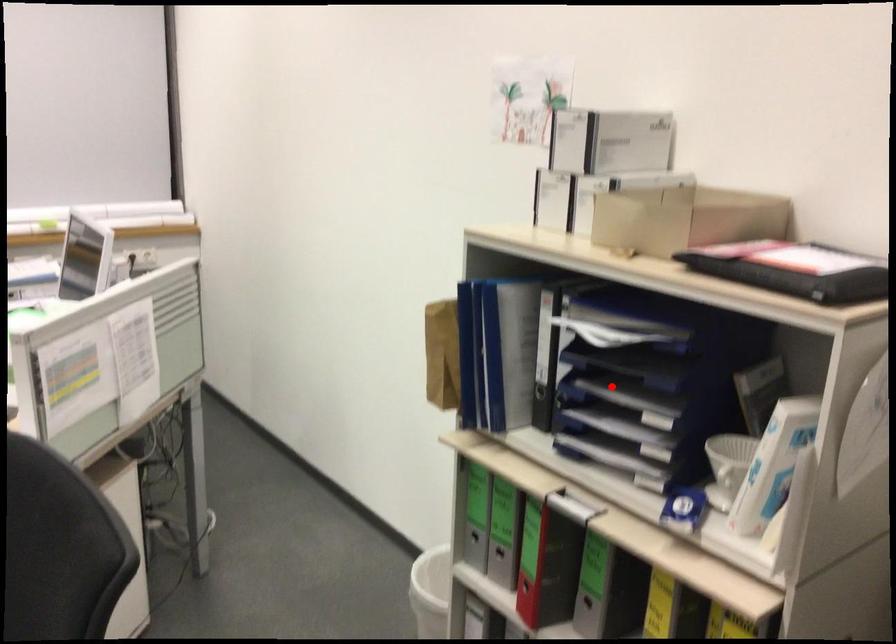
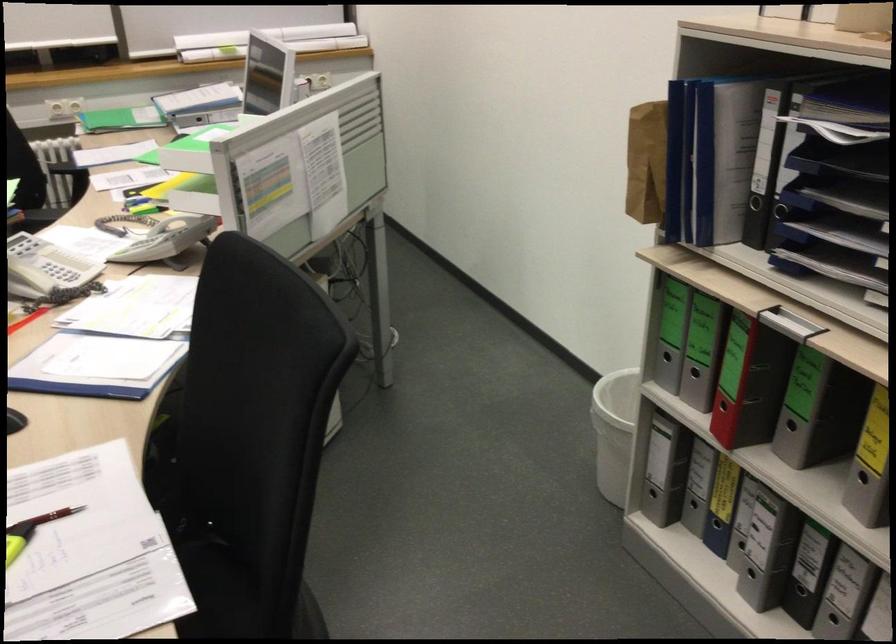
Question: I am providing you with two images of the same scene from different viewpoints. Image1 has a red point marked. In image2, the corresponding 3D location appears at what relative position? Reply with the corresponding letter.

Choices:
 (A) Closer
 (B) Farther

Answer: (A)